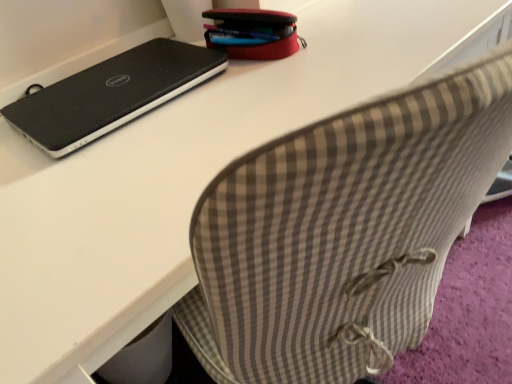
Question: From a real-world perspective, is black matte laptop at upper left on red fabric pencil case at upper center?

Choices:
 (A) no
 (B) yes

Answer: (A)

Question: Are black matte laptop at upper left and red fabric pencil case at upper center located far from each other?

Choices:
 (A) no
 (B) yes

Answer: (A)

Question: From the image's perspective, does black matte laptop at upper left appear lower than red fabric pencil case at upper center?

Choices:
 (A) yes
 (B) no

Answer: (A)

Question: Is black matte laptop at upper left to the left of red fabric pencil case at upper center from the viewer's perspective?

Choices:
 (A) yes
 (B) no

Answer: (A)

Question: Is black matte laptop at upper left to the right of red fabric pencil case at upper center from the viewer's perspective?

Choices:
 (A) yes
 (B) no

Answer: (B)

Question: From a real-world perspective, does black matte laptop at upper left sit lower than red fabric pencil case at upper center?

Choices:
 (A) yes
 (B) no

Answer: (A)

Question: Is red fabric pencil case at upper center next to black matte laptop at upper left and touching it?

Choices:
 (A) yes
 (B) no

Answer: (B)

Question: Would you say black matte laptop at upper left is part of red fabric pencil case at upper center's contents?

Choices:
 (A) no
 (B) yes

Answer: (A)

Question: Is red fabric pencil case at upper center positioned before black matte laptop at upper left?

Choices:
 (A) yes
 (B) no

Answer: (B)

Question: From the image's perspective, is red fabric pencil case at upper center below black matte laptop at upper left?

Choices:
 (A) no
 (B) yes

Answer: (A)

Question: Is red fabric pencil case at upper center outside black matte laptop at upper left?

Choices:
 (A) no
 (B) yes

Answer: (B)

Question: From the image's perspective, does red fabric pencil case at upper center appear higher than black matte laptop at upper left?

Choices:
 (A) yes
 (B) no

Answer: (A)

Question: Based on their positions, is black matte laptop at upper left located to the left or right of red fabric pencil case at upper center?

Choices:
 (A) right
 (B) left

Answer: (B)